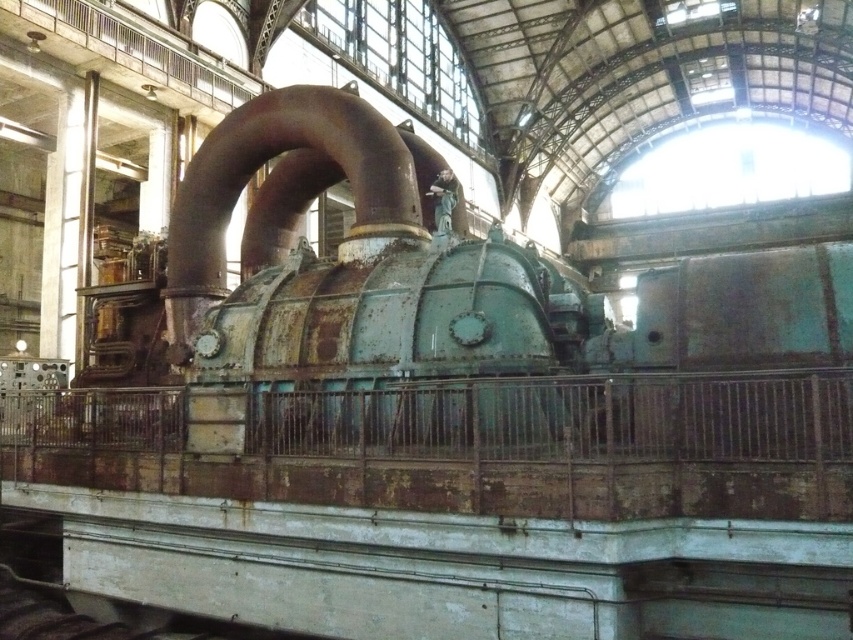
Question: Is rusty metal steam engine at center below rusty metal pipe at center?

Choices:
 (A) no
 (B) yes

Answer: (A)

Question: Is rusty metal steam engine at center positioned in front of rusty metal pipe at center?

Choices:
 (A) no
 (B) yes

Answer: (B)

Question: Which object appears farthest from the camera in this image?

Choices:
 (A) rusty metal steam engine at center
 (B) rusty metal pipe at center

Answer: (B)

Question: Does rusty metal steam engine at center have a smaller size compared to rusty metal pipe at center?

Choices:
 (A) yes
 (B) no

Answer: (B)

Question: Which of the following is the closest to the observer?

Choices:
 (A) rusty metal steam engine at center
 (B) rusty metal pipe at center

Answer: (A)